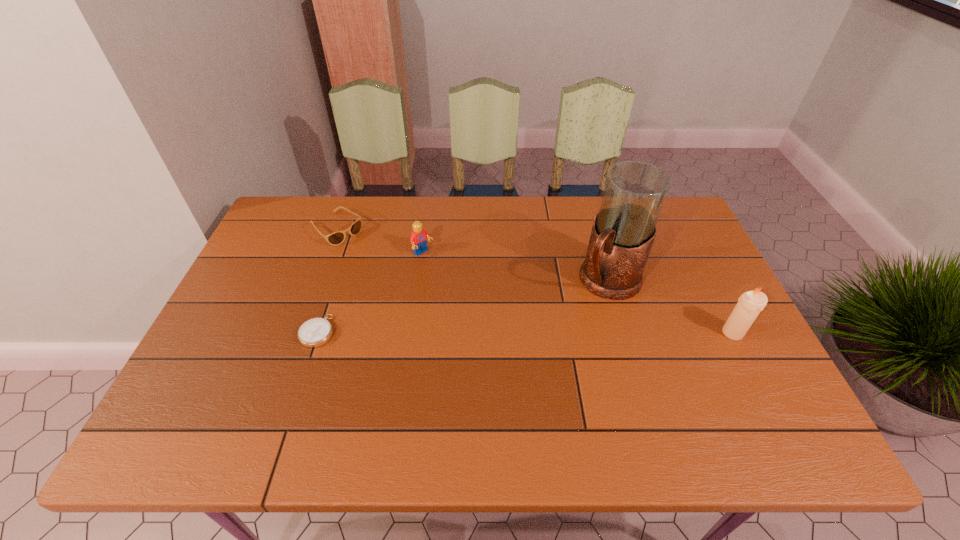
You are a GUI agent. You are given a task and a screenshot of the screen. Output one action in this format:
    pyautogui.click(x=<x>, y=<y>)
    Task: Click on the shortest object
    
    Given the screenshot: What is the action you would take?
    pyautogui.click(x=315, y=332)

Locate an element on the screen. The image size is (960, 540). the rightmost object is located at coordinates (751, 303).

At what (x,y) coordinates should I click in order to perform the action: click on the fourth shortest object. Please return your answer as a coordinate pair (x, y). Image resolution: width=960 pixels, height=540 pixels. Looking at the image, I should click on (751, 303).

This screenshot has width=960, height=540. I want to click on pitcher, so click(624, 229).

Find the location of `the fourth object from left to right`. the fourth object from left to right is located at coordinates (624, 229).

Where is `the third object from left to right`? The image size is (960, 540). the third object from left to right is located at coordinates (419, 237).

The image size is (960, 540). I want to click on the third shortest object, so click(419, 237).

Identify the location of the second shortest object. (336, 238).

The width and height of the screenshot is (960, 540). I want to click on vacant space situated 0.400m on the right of the compass, so click(x=491, y=331).

Where is `vacant space located 0.280m on the left of the fourth shortest object`? This screenshot has height=540, width=960. vacant space located 0.280m on the left of the fourth shortest object is located at coordinates (612, 333).